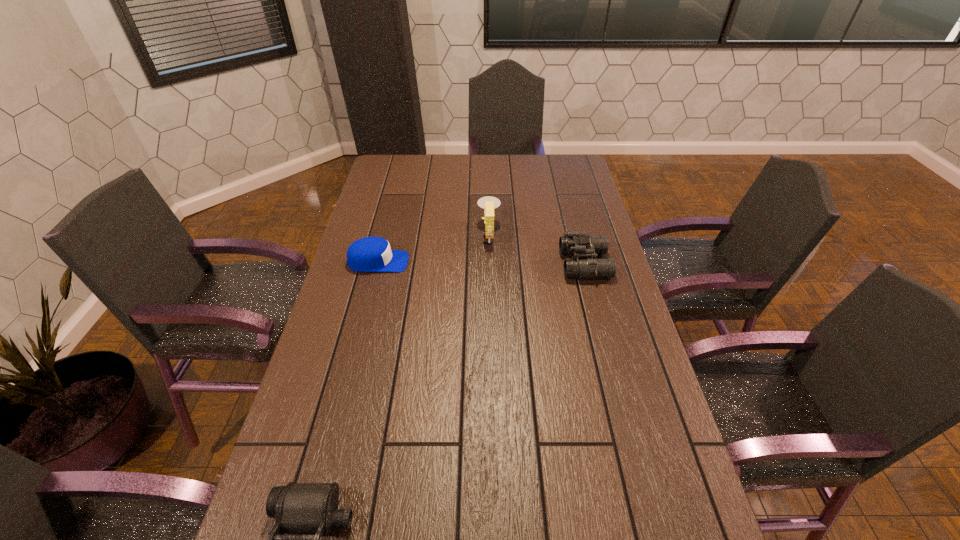
I want to click on free space located through the lenses of the taller binoculars, so pos(474,264).

Image resolution: width=960 pixels, height=540 pixels. Identify the location of free space located on the front-facing side of the baseball cap. (528, 262).

Where is `object situated at the left edge`? Image resolution: width=960 pixels, height=540 pixels. object situated at the left edge is located at coordinates (369, 254).

Where is `object located at the right edge`? This screenshot has height=540, width=960. object located at the right edge is located at coordinates (576, 243).

In order to click on vacant area at the far edge in this screenshot , I will do `click(507, 158)`.

Identify the location of free spot at the left edge of the desktop. (296, 462).

Where is `vacant area at the right edge of the desktop`? The image size is (960, 540). vacant area at the right edge of the desktop is located at coordinates (650, 444).

In the image, there is a desktop. Identify the location of free space at the far left corner. The width and height of the screenshot is (960, 540). (384, 159).

Image resolution: width=960 pixels, height=540 pixels. I want to click on vacant area at the far right corner of the desktop, so click(550, 172).

Locate an element on the screen. unoccupied position between the right binoculars and the baseball cap is located at coordinates (481, 263).